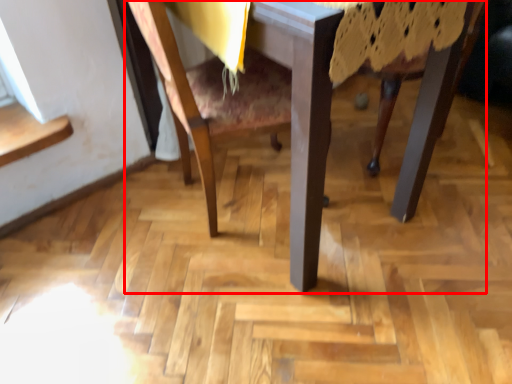
Question: From the image's perspective, what is the correct spatial relationship of table (annotated by the red box) in relation to chair?

Choices:
 (A) above
 (B) below

Answer: (A)